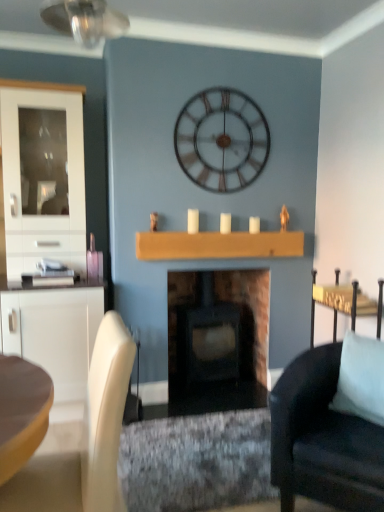
Identify the location of free spot above wooden mantel at center (from a real-world perspective). (237, 226).